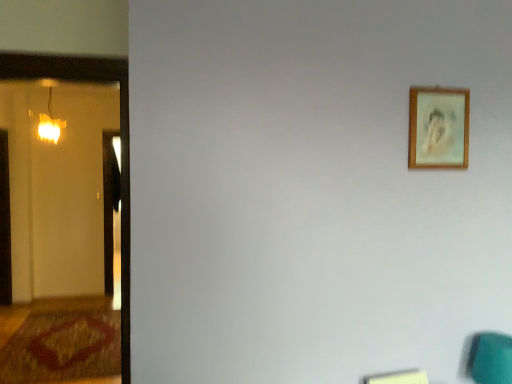
You are a GUI agent. You are given a task and a screenshot of the screen. Output one action in this format:
    pyautogui.click(x=<x>, y=<y>)
    Task: Click on the empty space that is ontop of brown textured rug at lower left (from a real-world perspective)
    The image size is (512, 384).
    Given the screenshot: What is the action you would take?
    pyautogui.click(x=62, y=352)